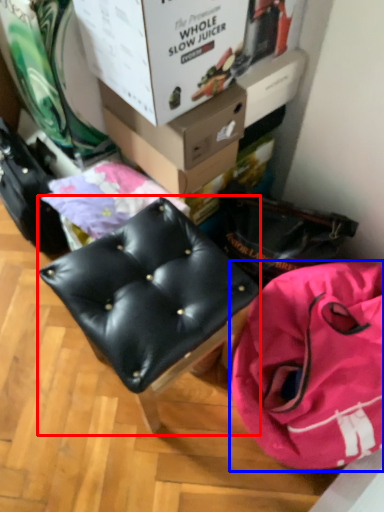
Question: Which object appears closest to the camera in this image, furniture (highlighted by a red box) or handbag (highlighted by a blue box)?

Choices:
 (A) furniture
 (B) handbag

Answer: (A)